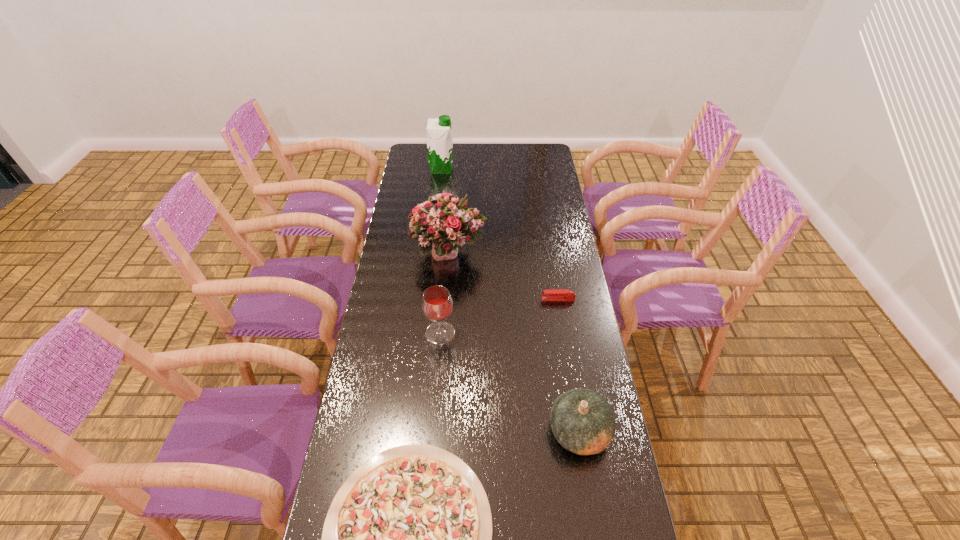
Locate an element on the screen. This screenshot has width=960, height=540. vacant space that is in between the gourd and the fifth tallest object is located at coordinates (568, 365).

Select which object is the second closest to the second shortest object. Please provide its 2D coordinates. Your answer should be formatted as a tuple, i.e. [(x, y)], where the tuple contains the x and y coordinates of a point satisfying the conditions above.

[(437, 304)]

Locate an element on the screen. This screenshot has height=540, width=960. object that can be found as the second closest to the pizza is located at coordinates (437, 304).

You are a GUI agent. You are given a task and a screenshot of the screen. Output one action in this format:
    pyautogui.click(x=<x>, y=<y>)
    Task: Click on the blank area in the image that satisfies the following two spatial constraints: 1. on the back side of the gourd; 2. on the front-facing side of the farthest object
    This screenshot has width=960, height=540.
    Given the screenshot: What is the action you would take?
    click(537, 169)

Find the location of a particular element. The image size is (960, 540). vacant space that satisfies the following two spatial constraints: 1. on the back side of the wineglass; 2. on the front-facing side of the farthest object is located at coordinates (453, 169).

This screenshot has height=540, width=960. I want to click on free point that satisfies the following two spatial constraints: 1. on the front-facing side of the soya milk; 2. on the left side of the bouquet, so click(x=433, y=253).